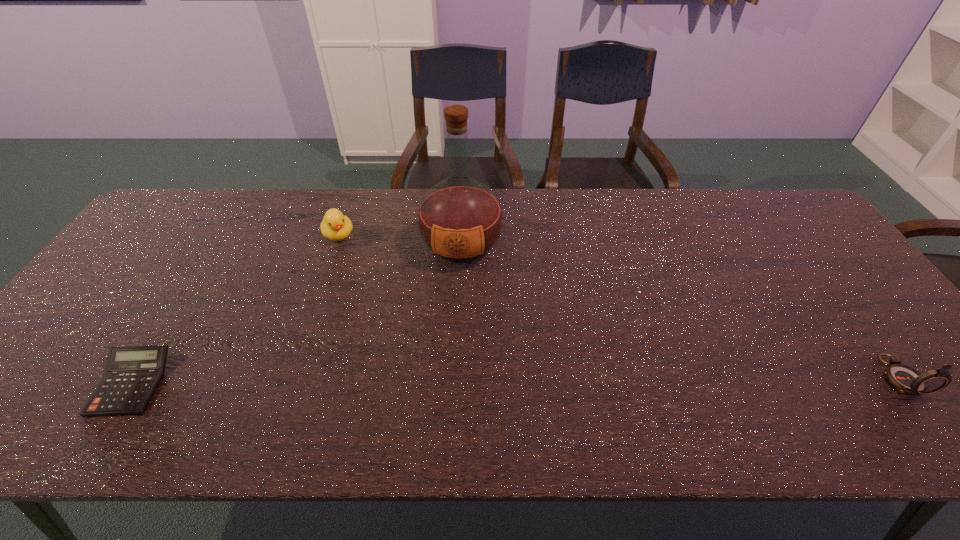
Image resolution: width=960 pixels, height=540 pixels. I want to click on vacant point located on the beak of the duckling, so click(348, 257).

Where is `vacant space located 0.400m on the beak of the duckling`? This screenshot has height=540, width=960. vacant space located 0.400m on the beak of the duckling is located at coordinates (387, 342).

Locate an element on the screen. The width and height of the screenshot is (960, 540). free point located 0.330m on the beak of the duckling is located at coordinates (378, 322).

Find the location of a particular element. The width and height of the screenshot is (960, 540). liquor present at the far edge is located at coordinates (460, 220).

At what (x,y) coordinates should I click in order to perform the action: click on duckling located in the far edge section of the desktop. Please return your answer as a coordinate pair (x, y). The width and height of the screenshot is (960, 540). Looking at the image, I should click on (335, 226).

The height and width of the screenshot is (540, 960). I want to click on calculator located at the near edge, so click(x=132, y=375).

Where is `compass that is at the near edge`? compass that is at the near edge is located at coordinates (904, 378).

The height and width of the screenshot is (540, 960). In order to click on object situated at the right edge in this screenshot , I will do `click(904, 378)`.

What are the coordinates of `object that is at the near right corner` in the screenshot? It's located at (904, 378).

Locate an element on the screen. Image resolution: width=960 pixels, height=540 pixels. free space at the far edge of the desktop is located at coordinates (657, 222).